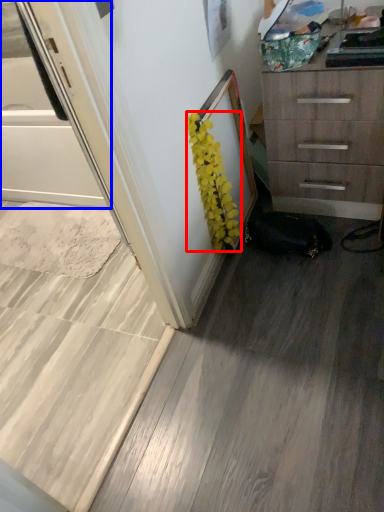
Question: Among these objects, which one is nearest to the camera, flower (highlighted by a red box) or screen door (highlighted by a blue box)?

Choices:
 (A) flower
 (B) screen door

Answer: (B)